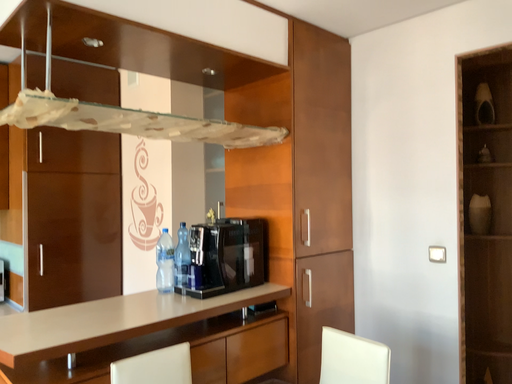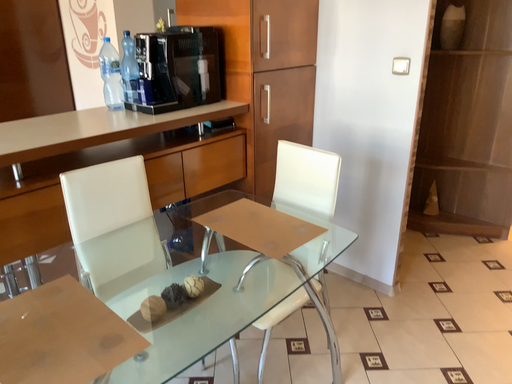
Question: How did the camera likely rotate when shooting the video?

Choices:
 (A) rotated downward
 (B) rotated upward

Answer: (A)